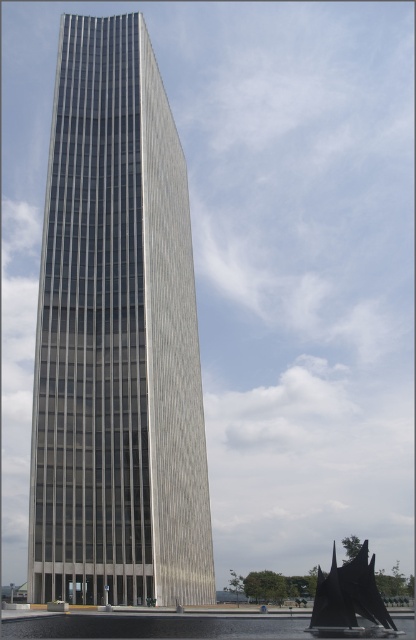
Question: Does silver glass skyscraper at center come in front of black matte sailboat at lower right?

Choices:
 (A) no
 (B) yes

Answer: (A)

Question: Which point is farther from the camera taking this photo?

Choices:
 (A) (143, 429)
 (B) (384, 632)

Answer: (A)

Question: Which point is closer to the camera taking this photo?

Choices:
 (A) (336, 573)
 (B) (34, 496)

Answer: (A)

Question: Does silver glass skyscraper at center appear under black matte sailboat at lower right?

Choices:
 (A) yes
 (B) no

Answer: (B)

Question: Is silver glass skyscraper at center thinner than black matte sailboat at lower right?

Choices:
 (A) yes
 (B) no

Answer: (A)